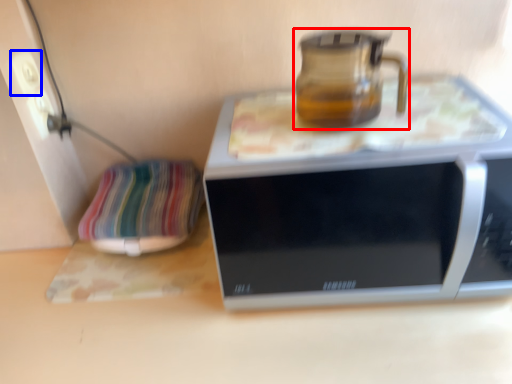
Question: Among these objects, which one is nearest to the camera, jug (highlighted by a red box) or electric outlet (highlighted by a blue box)?

Choices:
 (A) jug
 (B) electric outlet

Answer: (A)